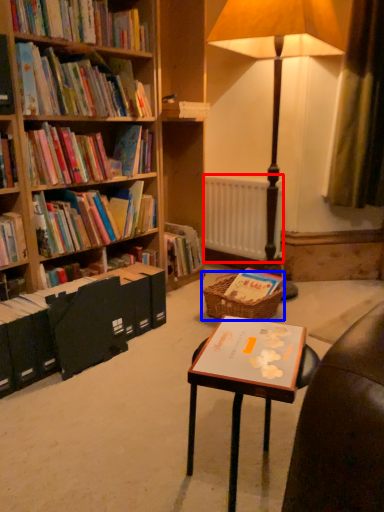
Question: Which of the following is the farthest to the observer, radiator (highlighted by a red box) or picnic basket (highlighted by a blue box)?

Choices:
 (A) radiator
 (B) picnic basket

Answer: (A)